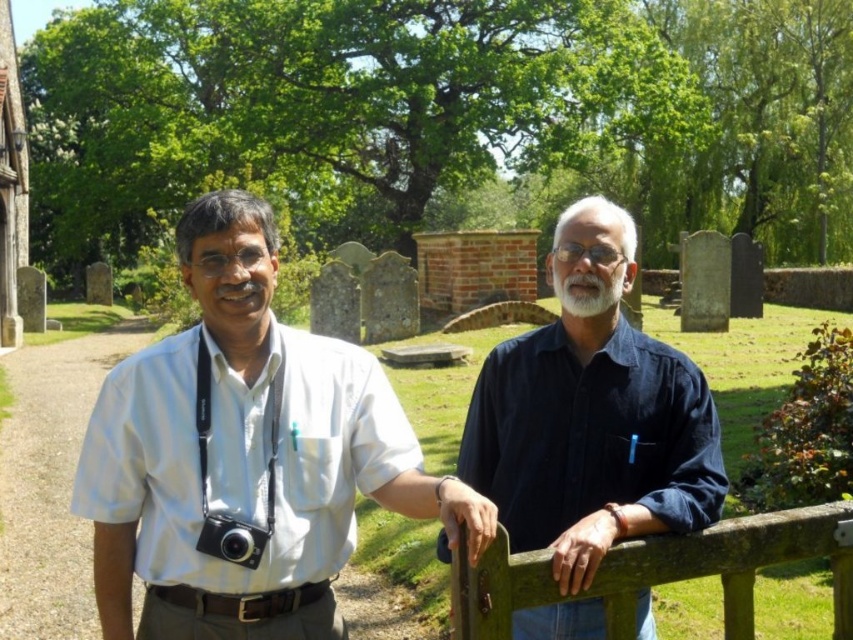
Question: Does brown wooden fence at right appear on the right side of black plastic camera at center?

Choices:
 (A) no
 (B) yes

Answer: (B)

Question: Which point is closer to the camera?

Choices:
 (A) (653, 410)
 (B) (460, 627)
 (C) (236, 554)

Answer: (B)

Question: Among these objects, which one is nearest to the camera?

Choices:
 (A) brown wooden fence at right
 (B) white soft beard at center
 (C) black plastic camera at center
 (D) dark blue shirt at center

Answer: (A)

Question: Can you confirm if white matte shirt at center is positioned to the right of brown wooden fence at right?

Choices:
 (A) yes
 (B) no

Answer: (B)

Question: Does white matte shirt at center have a smaller size compared to black plastic camera at center?

Choices:
 (A) yes
 (B) no

Answer: (B)

Question: Which of the following is the closest to the observer?

Choices:
 (A) (625, 256)
 (B) (347, 397)

Answer: (A)